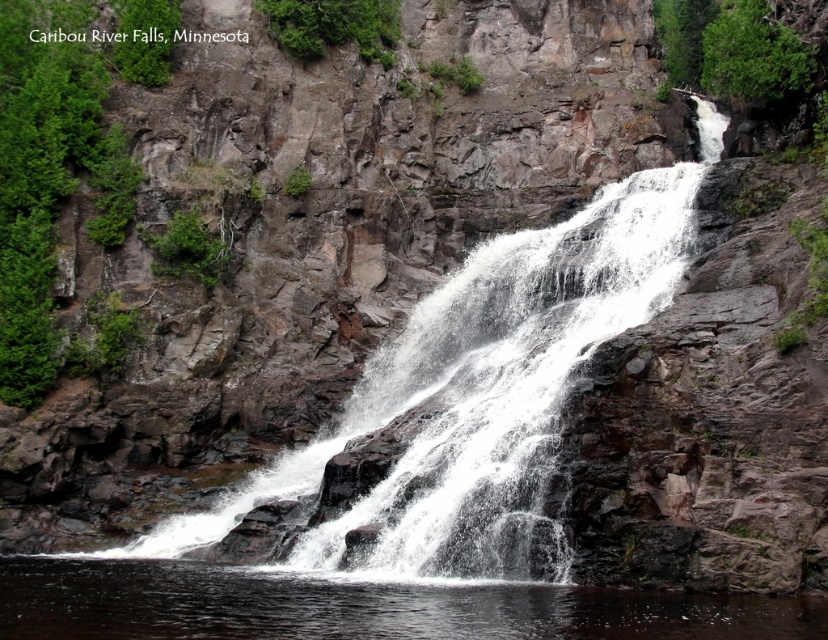
What do you see at coordinates (477, 396) in the screenshot? I see `white frothy water at center` at bounding box center [477, 396].

Based on the photo, can you confirm if white frothy water at center is thinner than clear water at center?

No.

Identify the location of white frothy water at center. Image resolution: width=828 pixels, height=640 pixels. (477, 396).